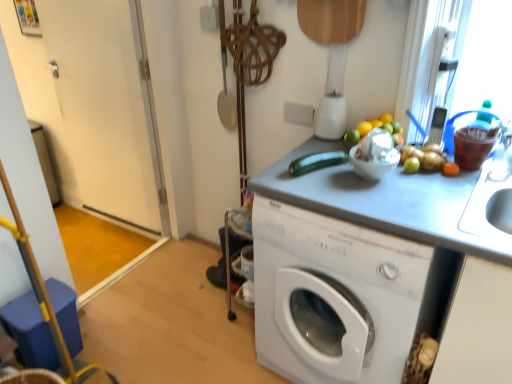
You are a GUI agent. You are given a task and a screenshot of the screen. Output one action in this format:
    pyautogui.click(x=<x>, y=<y>)
    Task: Click on the vacant space to the left of white glossy bowl at center
    The width and height of the screenshot is (512, 384).
    Given the screenshot: What is the action you would take?
    tap(323, 183)